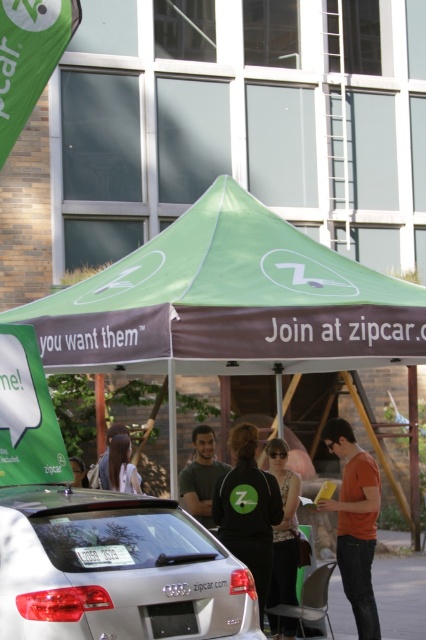
You are a delivery person with a cart that is 2 meters wide. You need to move from the satin silver car at center to the matte black jacket at center. Is there enough space for your cart to pass between them?

The distance between the satin silver car at center and the matte black jacket at center is 3.95 meters, so yes, the cart can pass through since it is wider than the cart.

You are standing at the event entrance and want to take a photo of the satin silver car at center. If your camera can focus on objects up to 20 feet away, will you be able to capture a clear photo?

The satin silver car at center is 17.22 feet away from the camera. Since your camera can focus up to 20 feet, you can capture a clear photo.